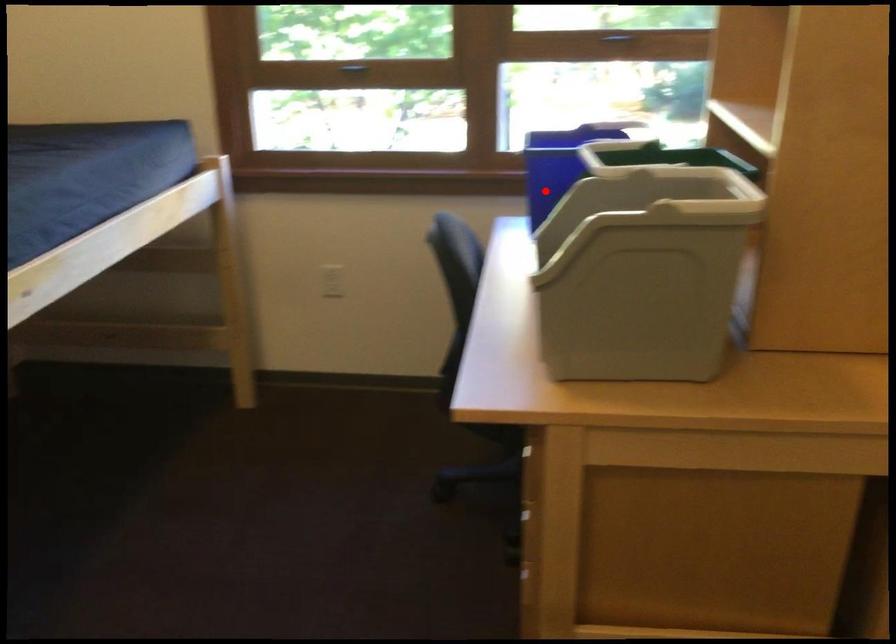
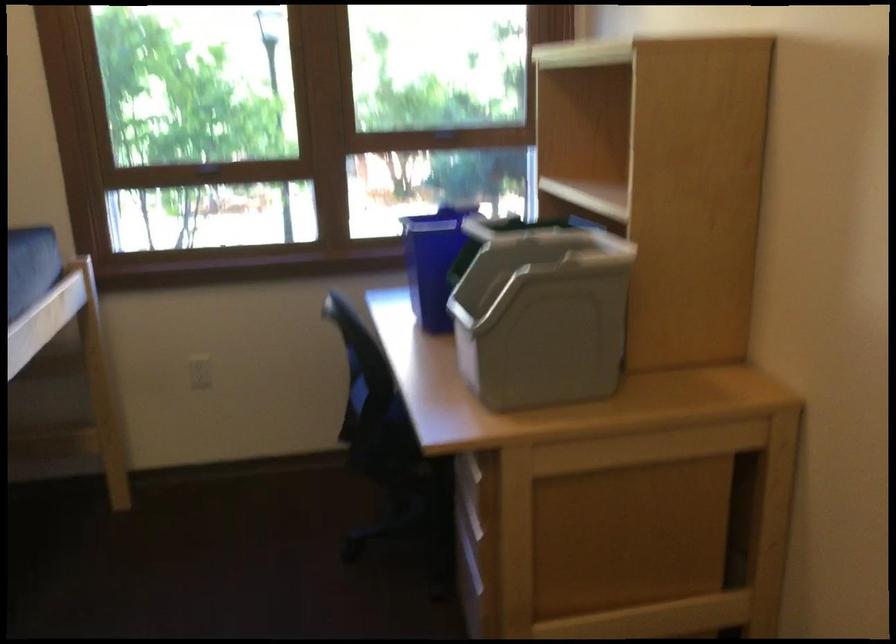
Find the pixel in the second image that matches the highlighted location in the first image.

(433, 261)